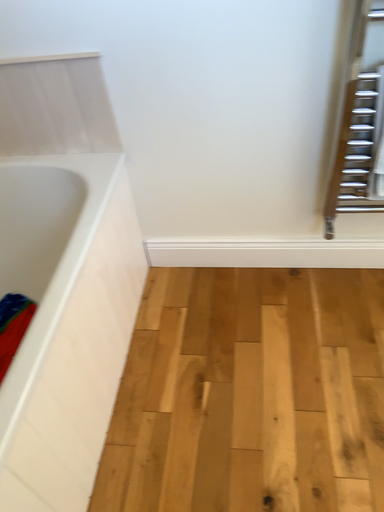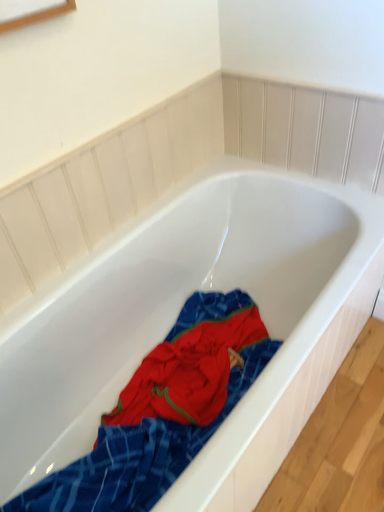
Question: Which way did the camera rotate in the video?

Choices:
 (A) rotated right
 (B) rotated left

Answer: (B)